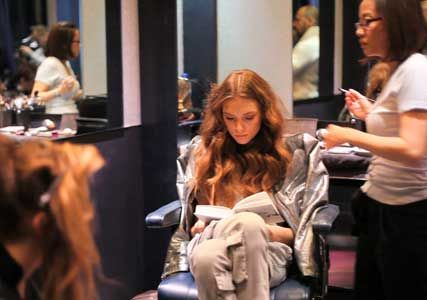
I want to click on mirror, so point(39,62).